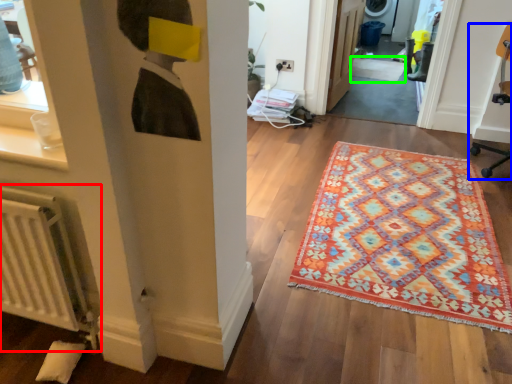
Question: Considering the real-world distances, which object is farthest from radiator (highlighted by a red box)? swivel chair (highlighted by a blue box) or doormat (highlighted by a green box)?

Choices:
 (A) swivel chair
 (B) doormat

Answer: (B)